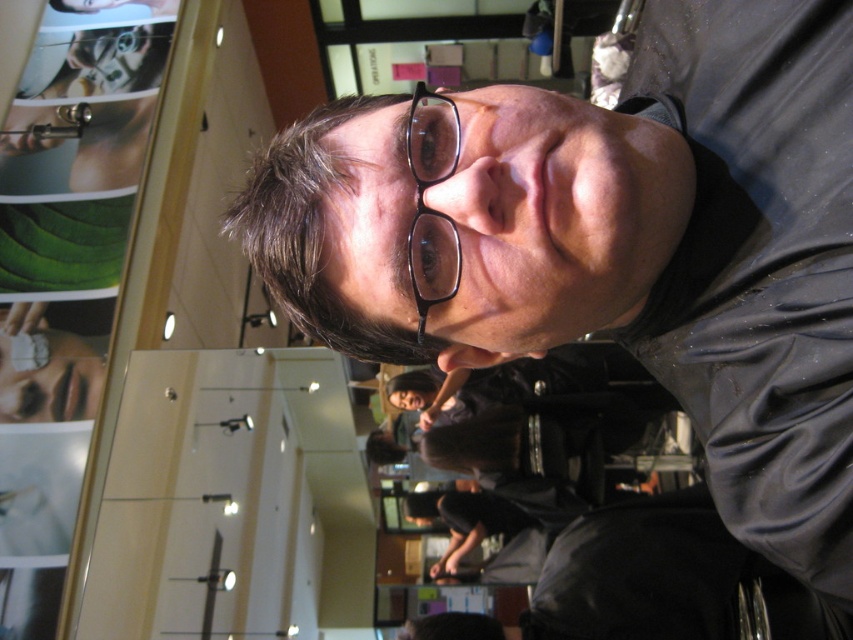
Does matte black glasses at upper center have a larger size compared to black plastic glasses at center?

Indeed, matte black glasses at upper center has a larger size compared to black plastic glasses at center.

Which is in front, point (770, 548) or point (445, 224)?

Point (770, 548) is in front.

Is point (480, 116) farther from viewer compared to point (430, 273)?

No, it is not.

The image size is (853, 640). In order to click on matte black glasses at upper center in this screenshot , I will do `click(621, 244)`.